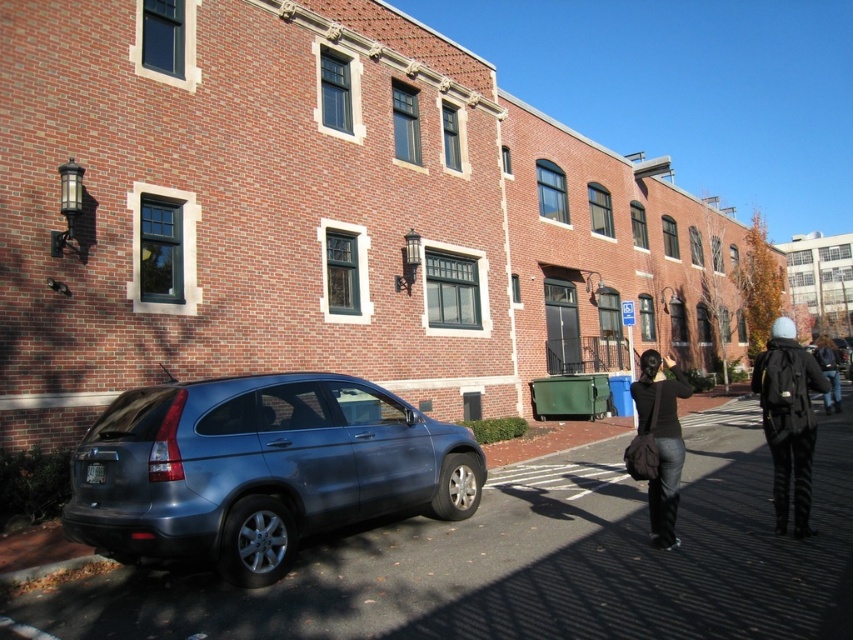
Question: Is the position of metallic gray car at lower left less distant than that of dark blue jeans at lower right?

Choices:
 (A) no
 (B) yes

Answer: (B)

Question: Estimate the real-world distances between objects in this image. Which object is farther from the dark brown leather bag at lower right?

Choices:
 (A) dark blue jeans at lower right
 (B) satin blue minivan at lower left
 (C) white woolen hat at right

Answer: (A)

Question: Which object is the closest to the dark brown leather bag at lower right?

Choices:
 (A) dark blue jeans at lower right
 (B) metallic gray car at lower left
 (C) satin blue minivan at lower left

Answer: (B)

Question: Is metallic gray car at lower left positioned before dark brown leather bag at lower right?

Choices:
 (A) yes
 (B) no

Answer: (A)

Question: Which object is positioned farthest from the metallic gray car at lower left?

Choices:
 (A) dark brown leather bag at lower right
 (B) white woolen hat at right
 (C) dark blue jeans at lower right

Answer: (C)

Question: Can you confirm if white woolen hat at right is smaller than dark blue jeans at lower right?

Choices:
 (A) no
 (B) yes

Answer: (B)